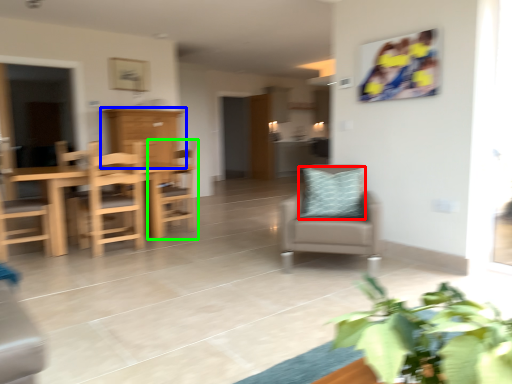
Question: Estimate the real-world distances between objects in this image. Which object is closer to pillow (highlighted by a red box), cabinetry (highlighted by a blue box) or chair (highlighted by a green box)?

Choices:
 (A) cabinetry
 (B) chair

Answer: (B)